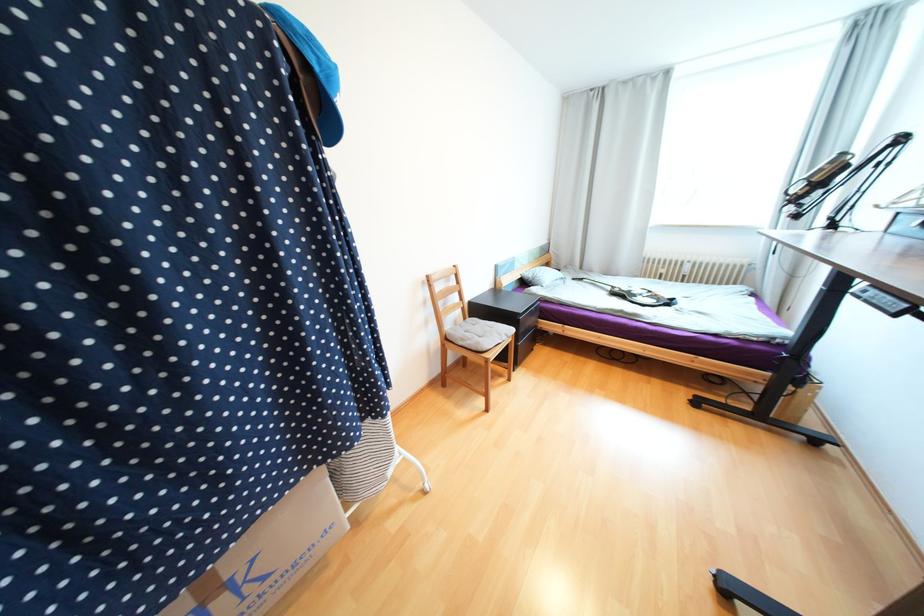
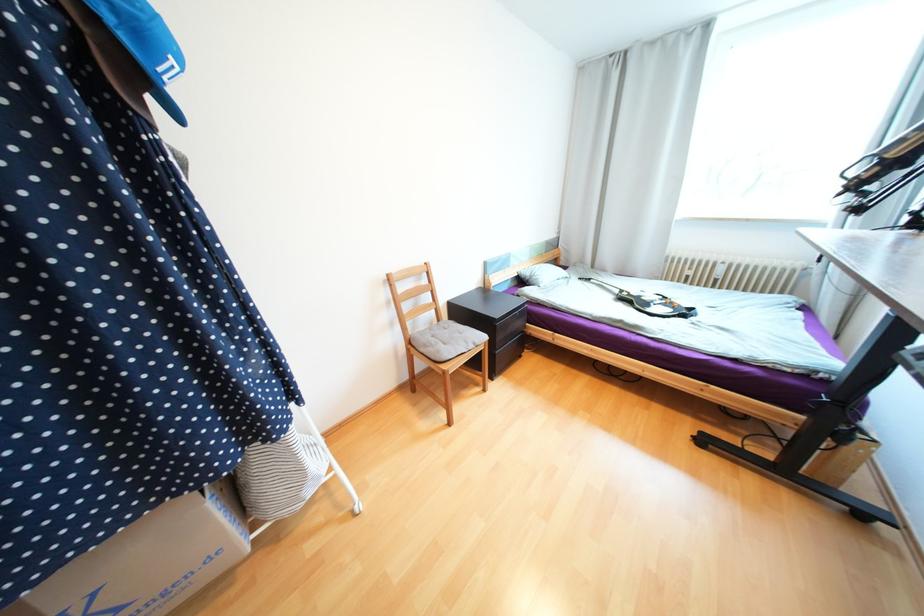
Question: The images are taken continuously from a first-person perspective. In which direction is your viewpoint rotating?

Choices:
 (A) Left
 (B) Right
 (C) Up
 (D) Down

Answer: (A)